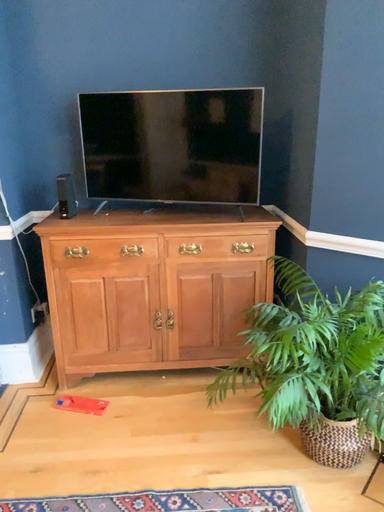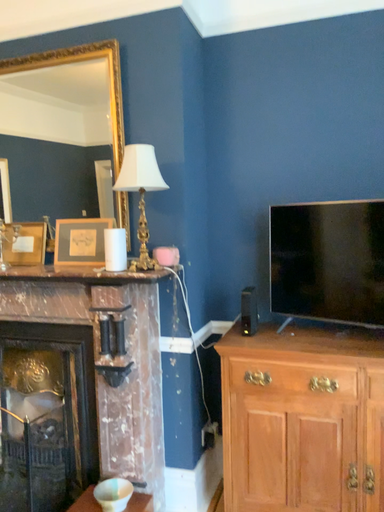
Question: How did the camera likely rotate when shooting the video?

Choices:
 (A) rotated upward
 (B) rotated downward

Answer: (A)